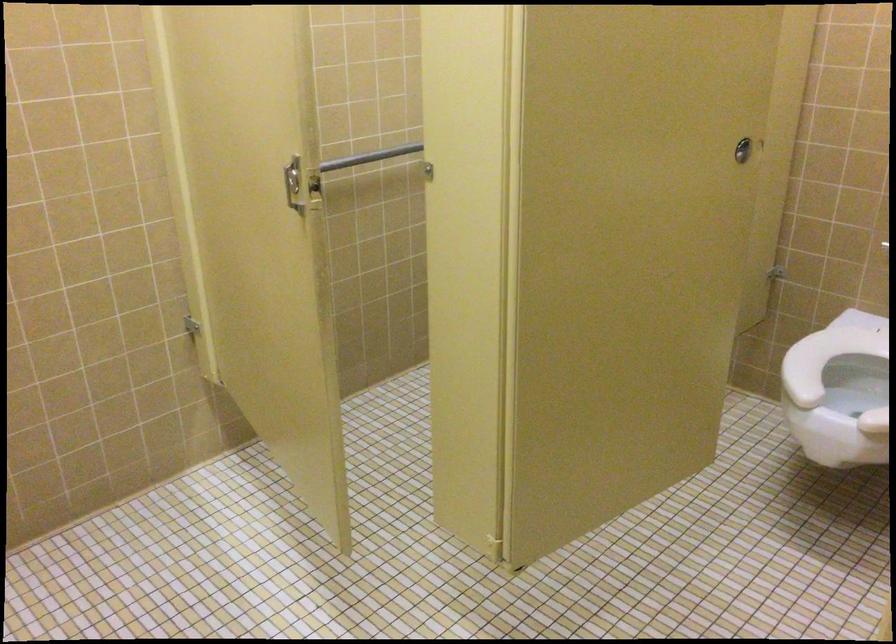
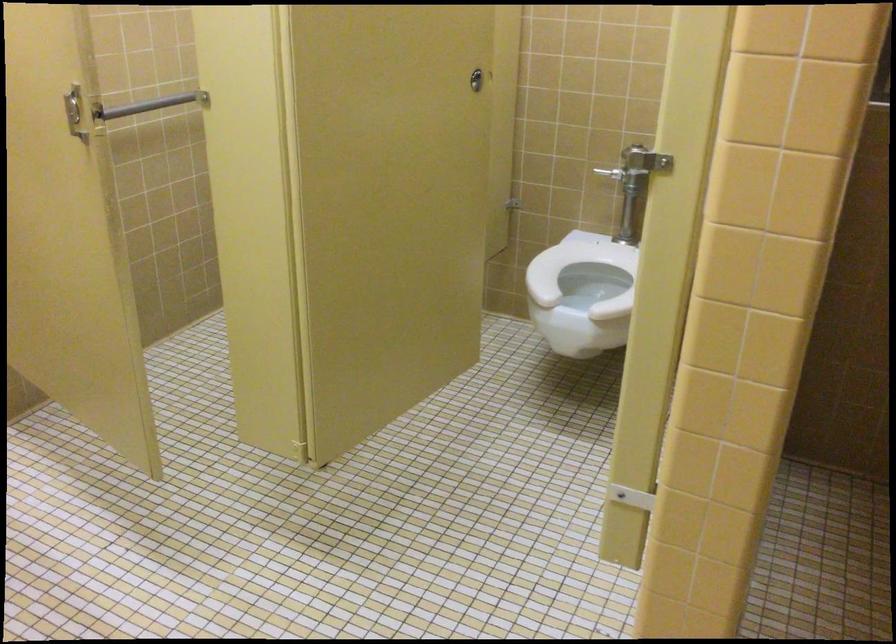
The point at [291,180] is marked in the first image. Where is the corresponding point in the second image?

(74, 111)